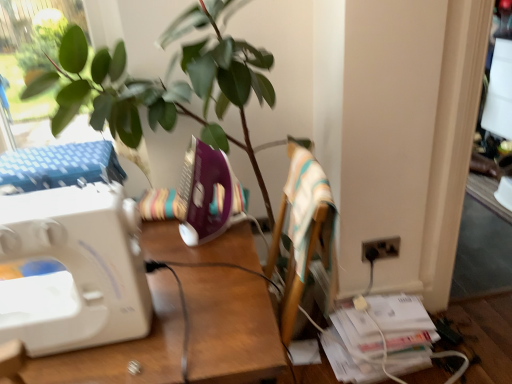
The height and width of the screenshot is (384, 512). I want to click on free location in front of purple plastic sewing machine at center, which is the first sewing machine in right-to-left order, so click(x=208, y=259).